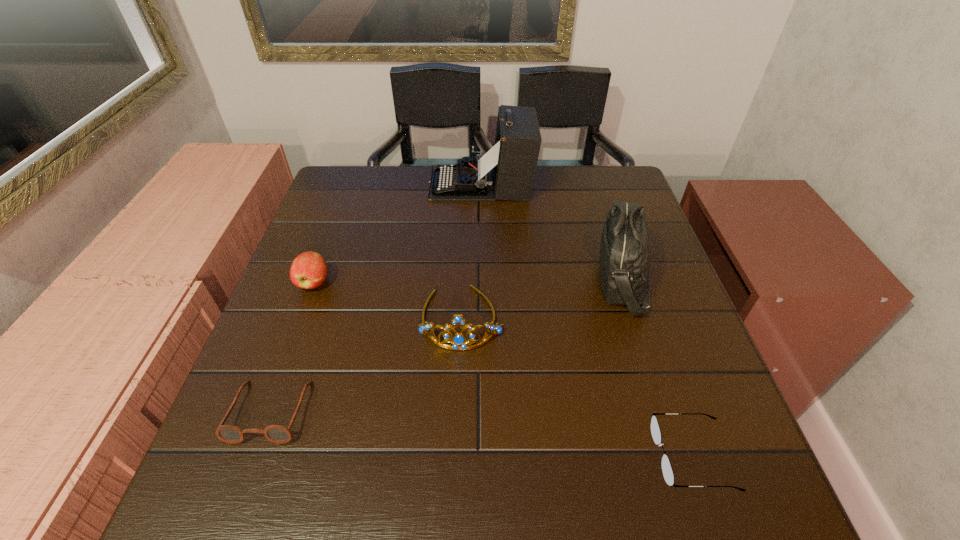
You are a GUI agent. You are given a task and a screenshot of the screen. Output one action in this format:
    pyautogui.click(x=<x>, y=<y>)
    Task: Click on the vacant area between the shortest object and the tiara
    
    Given the screenshot: What is the action you would take?
    pyautogui.click(x=577, y=387)

This screenshot has height=540, width=960. Identify the location of free space between the right spectacles and the third tallest object. (577, 387).

Locate an element on the screen. Image resolution: width=960 pixels, height=540 pixels. vacant area that lies between the left spectacles and the typewriter is located at coordinates (375, 298).

Where is `object that stands as the second closest to the typewriter`? object that stands as the second closest to the typewriter is located at coordinates (459, 341).

I want to click on object that ranks as the fifth closest to the third shortest object, so click(x=667, y=471).

The image size is (960, 540). In order to click on vacant area that satisfies the following two spatial constraints: 1. inside the open case of the farthest object; 2. on the front-facing side of the third tallest object in this screenshot , I will do `click(481, 318)`.

Identify the location of free spot that satisfies the following two spatial constraints: 1. at the front padded panel of the second tallest object; 2. on the front-facing side of the tiara. pyautogui.click(x=636, y=318).

Locate an element on the screen. The image size is (960, 540). vacant space that satisfies the following two spatial constraints: 1. at the front padded panel of the shoulder bag; 2. on the front-facing side of the tiara is located at coordinates (636, 318).

This screenshot has height=540, width=960. I want to click on free location that satisfies the following two spatial constraints: 1. at the front padded panel of the fifth shortest object; 2. on the front-facing side of the fourth shortest object, so click(x=636, y=318).

Where is `free space that satisfies the following two spatial constraints: 1. inside the open case of the farthest object; 2. on the front-facing side of the tiara`? This screenshot has width=960, height=540. free space that satisfies the following two spatial constraints: 1. inside the open case of the farthest object; 2. on the front-facing side of the tiara is located at coordinates (481, 318).